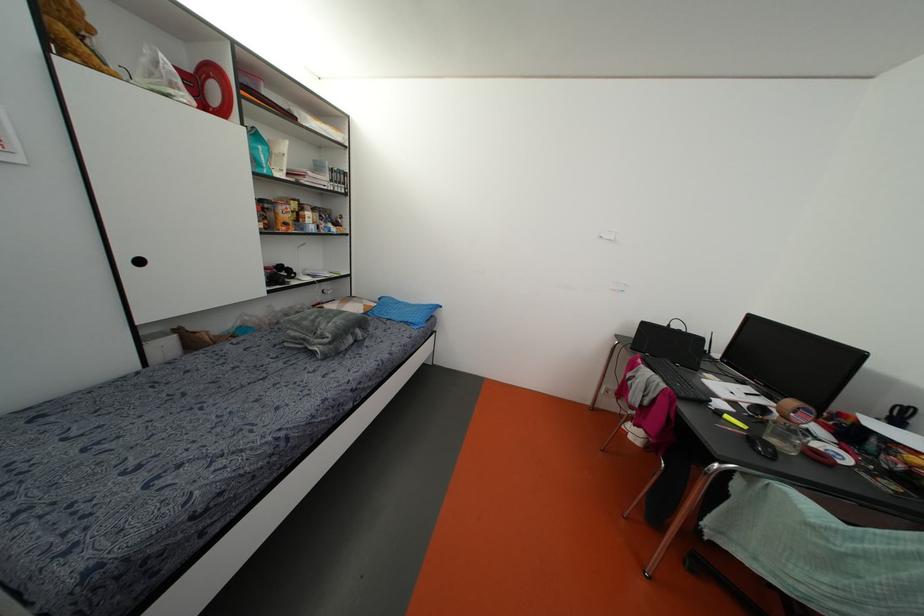
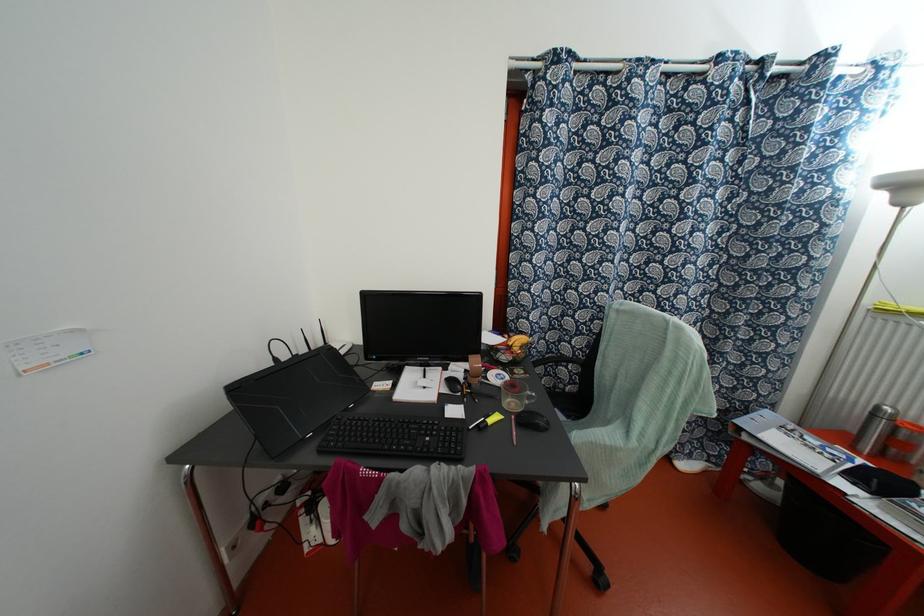
In the second image, find the point that corresponds to (x=727, y=416) in the first image.

(489, 421)